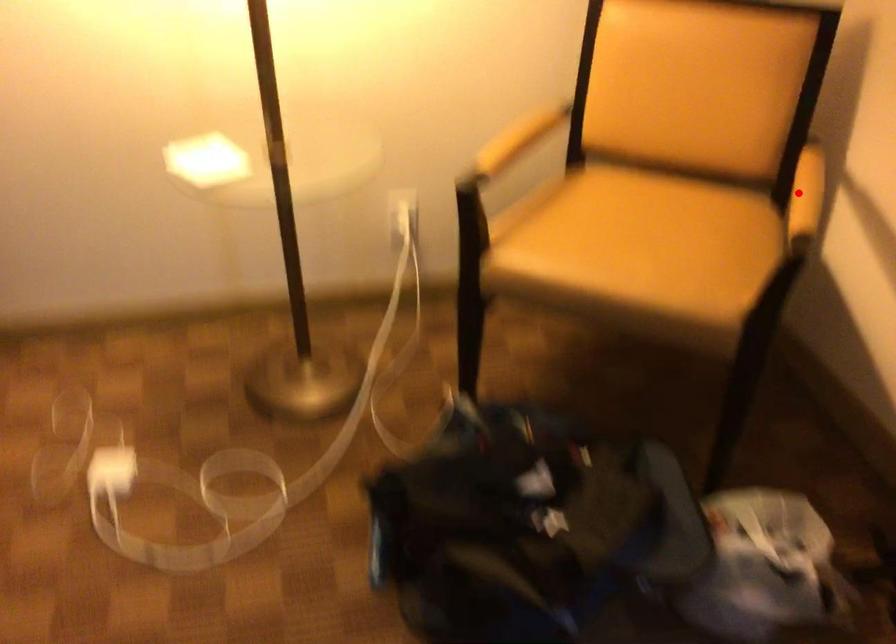
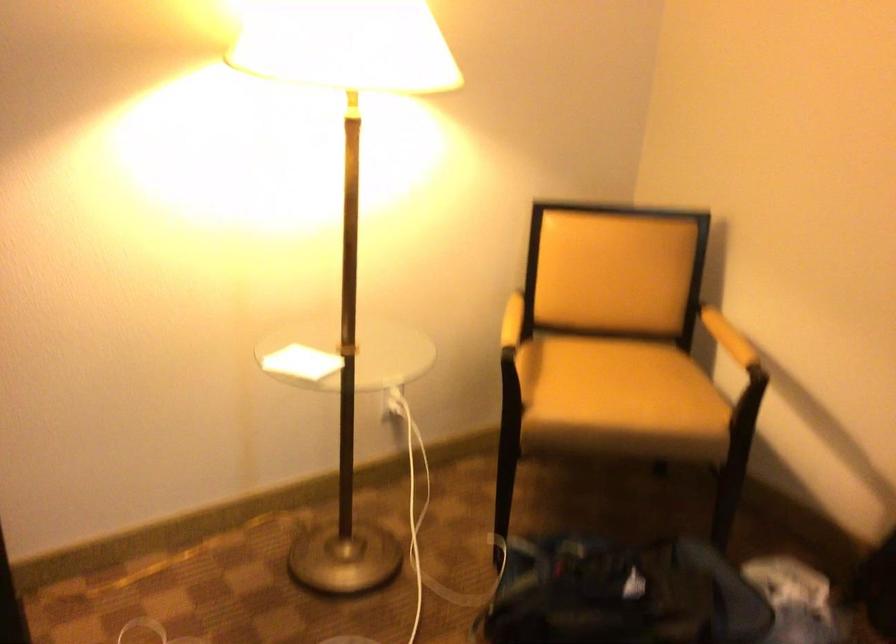
Where in the second image is the point corresponding to the highlighted location from the first image?

(728, 337)